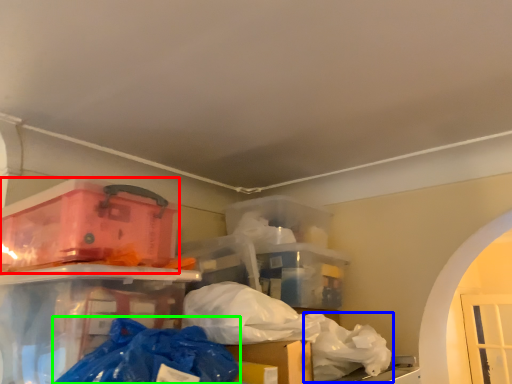
Question: Considering the real-world distances, which object is farthest from box (highlighted by a red box)? plastic bag (highlighted by a blue box) or plastic bag (highlighted by a green box)?

Choices:
 (A) plastic bag
 (B) plastic bag

Answer: (A)